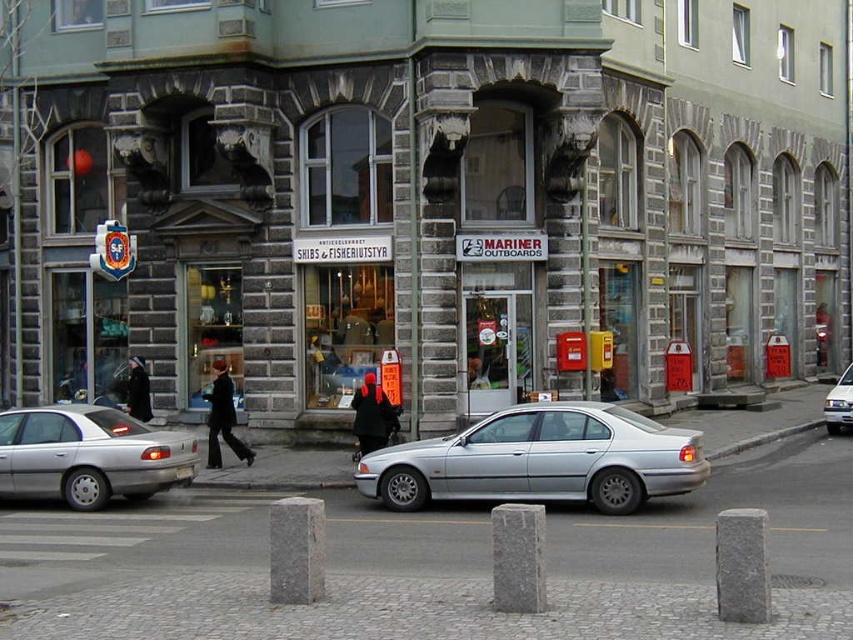
Locate an element on the screen. The width and height of the screenshot is (853, 640). silver metallic car at center is located at coordinates (541, 460).

Which is more to the left, silver metallic car at center or black matte coat at center?

black matte coat at center is more to the left.

Between point (659, 477) and point (140, 397), which one is positioned in front?

Point (659, 477) is in front.

Where is `silver metallic car at center`? The width and height of the screenshot is (853, 640). silver metallic car at center is located at coordinates (541, 460).

Describe the element at coordinates (372, 416) in the screenshot. I see `black wool coat at center` at that location.

Does black wool coat at center have a lesser height compared to dark brown leather coat at center?

Yes.

Between point (396, 420) and point (215, 448), which one is positioned behind?

The point (396, 420) is more distant.

Where is `black wool coat at center`? The width and height of the screenshot is (853, 640). black wool coat at center is located at coordinates (372, 416).

From the picture: Does silver metallic sedan at left appear over black matte coat at center?

Incorrect, silver metallic sedan at left is not positioned above black matte coat at center.

Does silver metallic sedan at left have a greater height compared to black matte coat at center?

Yes, silver metallic sedan at left is taller than black matte coat at center.

Is point (122, 461) positioned after point (131, 378)?

No, it is not.

Image resolution: width=853 pixels, height=640 pixels. What are the coordinates of `silver metallic sedan at left` in the screenshot? It's located at (90, 456).